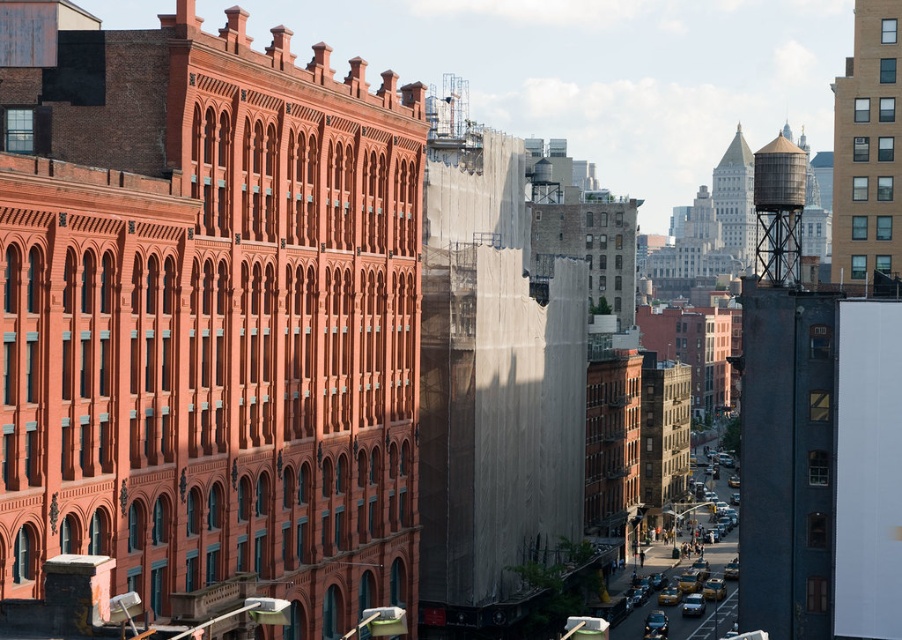
Consider the image. You are a delivery driver who needs to park your shiny black sedan at center as close as possible to the rustic metal water tower at upper right. Given that the parking space is only 40 meters long, can you park your car within the parking space and still be close to the water tower?

The rustic metal water tower at upper right is 37.57 meters from the shiny black sedan at center. Since the parking space is 40 meters long, which is longer than the distance between them, you can park the shiny black sedan at center within the parking space and still be close to the water tower.

You are a delivery driver who needs to park your shiny black sedan at center near the metallic gray water tower at right. Given that the parking space next to the water tower is only 3 meters wide, can your sedan fit there?

The metallic gray water tower at right is larger than the shiny black sedan at center. Since the parking space is 3 meters wide, the sedan can fit as it is smaller than the water tower, but this does not directly indicate the space sufficiency. However, without knowing the exact dimensions of the sedan, we cannot confirm. Wait, the description says the water tower is larger, but the parking space is 3m. Maybe the sedan is smaller than the water tower, so if the sedan is narrower than 3m, it can fit. But the